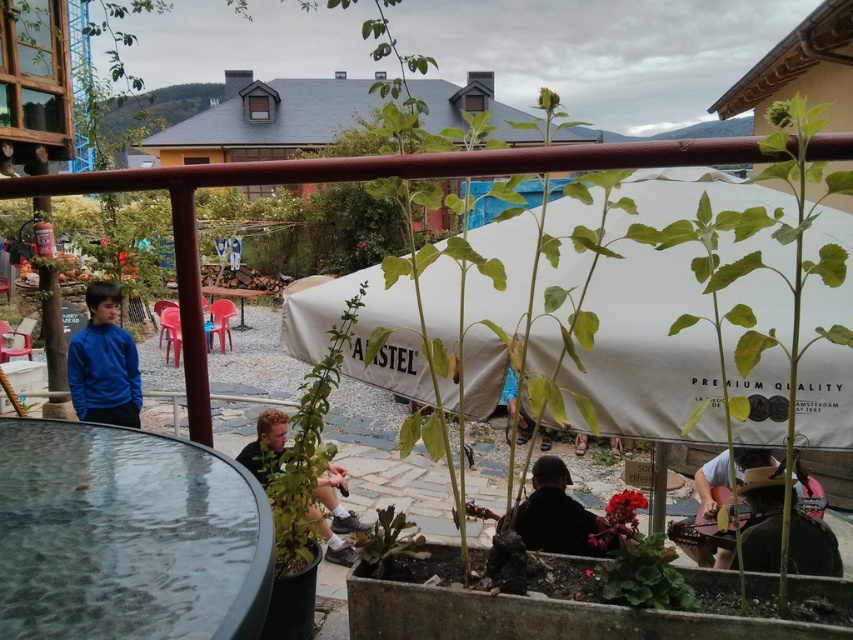
Question: Estimate the real-world distances between objects in this image. Which object is closer to the green leafy plant at center?

Choices:
 (A) white canvas canopy at center
 (B) blue fleece jacket at left

Answer: (A)

Question: Which point is farther from the camera taking this photo?

Choices:
 (A) (257, 292)
 (B) (549, 540)
 (C) (352, 538)
 (D) (225, 566)

Answer: (A)

Question: Which object is the farthest from the wooden table at center?

Choices:
 (A) green leafy plant at center
 (B) black matte shirt at center
 (C) blue fleece jacket at left

Answer: (A)

Question: Can you confirm if transparent glass table at lower left is positioned to the left of black matte shirt at center?

Choices:
 (A) yes
 (B) no

Answer: (B)

Question: Does white canvas canopy at center have a larger size compared to transparent glass table at lower left?

Choices:
 (A) yes
 (B) no

Answer: (A)

Question: Is the position of dark matte jacket at center less distant than that of black matte shirt at center?

Choices:
 (A) no
 (B) yes

Answer: (B)